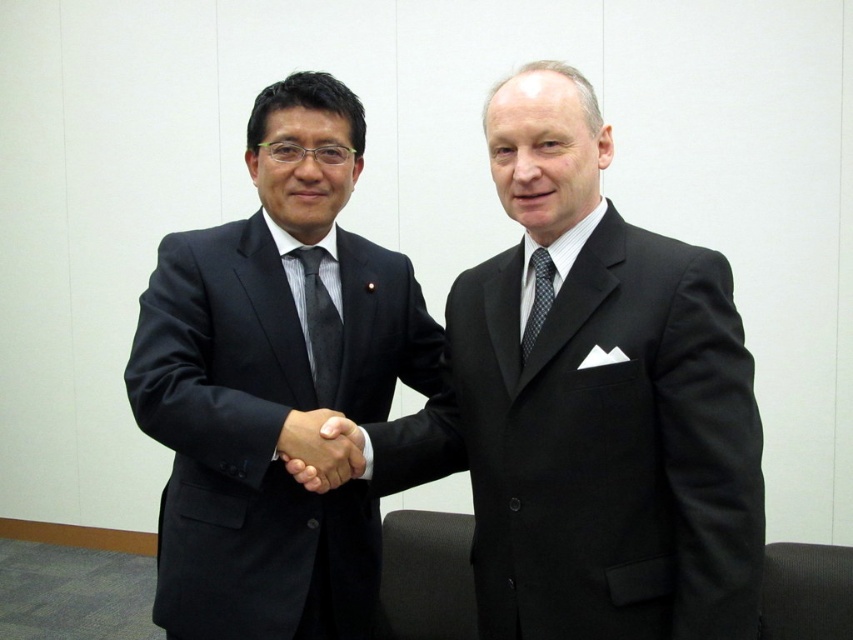
Question: Which point is farther to the camera?

Choices:
 (A) black smooth hand at center
 (B) matte black suit at left
 (C) dark blue textured tie at center

Answer: (B)

Question: Is dark gray striped tie at center behind dark blue textured tie at center?

Choices:
 (A) yes
 (B) no

Answer: (A)

Question: Can you confirm if matte black suit at left is positioned above dark gray striped tie at center?

Choices:
 (A) no
 (B) yes

Answer: (A)

Question: Which of these objects is positioned farthest from the matte black suit at left?

Choices:
 (A) black matte suit at center
 (B) black smooth hand at center
 (C) dark blue textured tie at center
 (D) dark gray striped tie at center

Answer: (C)

Question: Observing the image, what is the correct spatial positioning of black matte suit at center in reference to matte black suit at left?

Choices:
 (A) right
 (B) left

Answer: (A)

Question: Among these objects, which one is farthest from the camera?

Choices:
 (A) matte black suit at left
 (B) black matte suit at center
 (C) black smooth hand at center

Answer: (A)